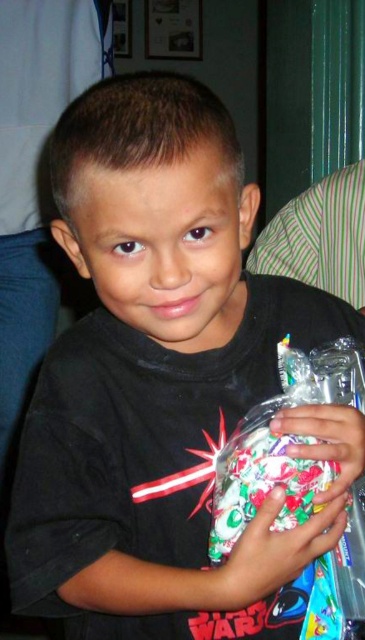
Question: Does shiny plastic bag of candies at center appear under translucent plastic jar at center?

Choices:
 (A) no
 (B) yes

Answer: (B)

Question: Among these objects, which one is nearest to the camera?

Choices:
 (A) shiny plastic bag of candies at center
 (B) floral fabric wrapped gift at center
 (C) translucent plastic jar at center

Answer: (B)

Question: Which object is the farthest from the shiny plastic bag of candies at center?

Choices:
 (A) translucent plastic jar at center
 (B) floral fabric wrapped gift at center

Answer: (A)

Question: Which point is closer to the camera taking this photo?

Choices:
 (A) (314, 406)
 (B) (214, 532)

Answer: (A)

Question: Does shiny plastic bag of candies at center appear on the left side of floral fabric wrapped gift at center?

Choices:
 (A) yes
 (B) no

Answer: (A)

Question: Is shiny plastic bag of candies at center thinner than translucent plastic jar at center?

Choices:
 (A) no
 (B) yes

Answer: (A)